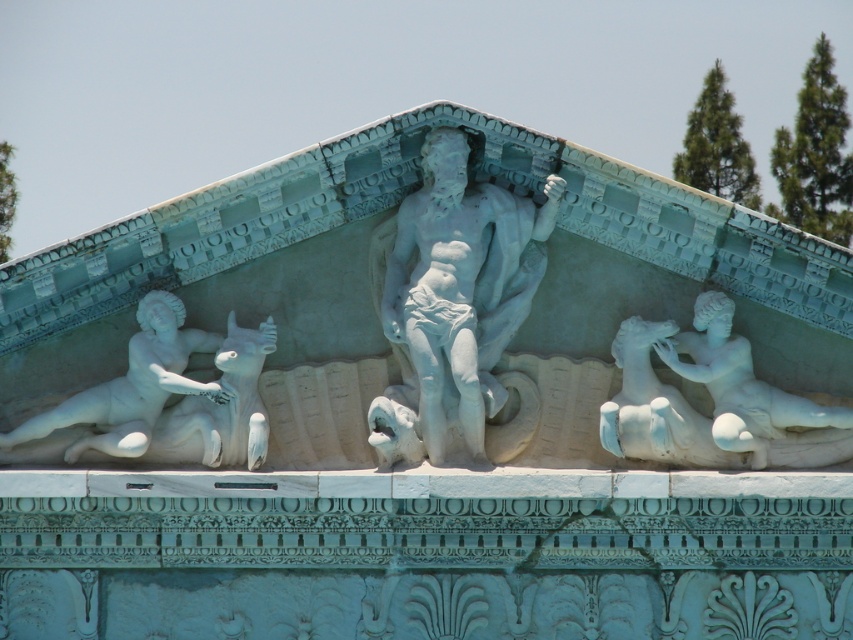
Question: Is white marble statue at center wider than white marble statue at left?

Choices:
 (A) yes
 (B) no

Answer: (A)

Question: Is white marble statue at center thinner than white marble statue at left?

Choices:
 (A) no
 (B) yes

Answer: (A)

Question: Which of the following is the farthest from the observer?

Choices:
 (A) (140, 412)
 (B) (369, 404)

Answer: (B)

Question: In this image, where is white marble statue at center located relative to white marble statue at left?

Choices:
 (A) right
 (B) left

Answer: (A)